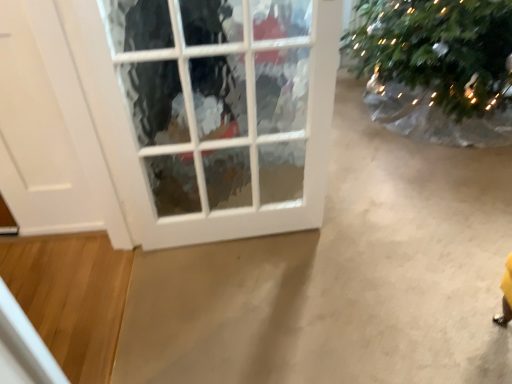
Question: In terms of width, does white matte door at left look wider or thinner when compared to white glass window at center?

Choices:
 (A) thin
 (B) wide

Answer: (A)

Question: From their relative heights in the image, would you say white matte door at left is taller or shorter than white glass window at center?

Choices:
 (A) short
 (B) tall

Answer: (A)

Question: Which is farther from the white glass window at center?

Choices:
 (A) white matte door at left
 (B) green textured christmas tree at upper right

Answer: (B)

Question: Considering the real-world distances, which object is farthest from the white glass window at center?

Choices:
 (A) green textured christmas tree at upper right
 (B) white matte door at left

Answer: (A)